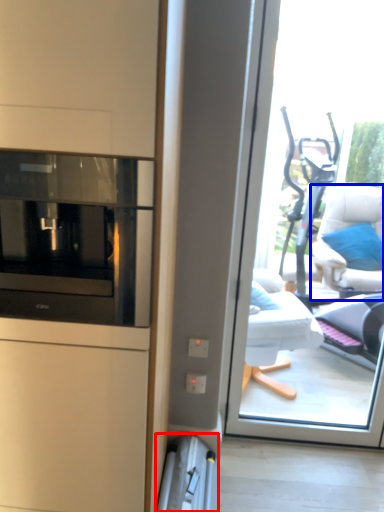
Question: Which of the following is the closest to the observer, appliance (highlighted by a red box) or furniture (highlighted by a blue box)?

Choices:
 (A) appliance
 (B) furniture

Answer: (A)